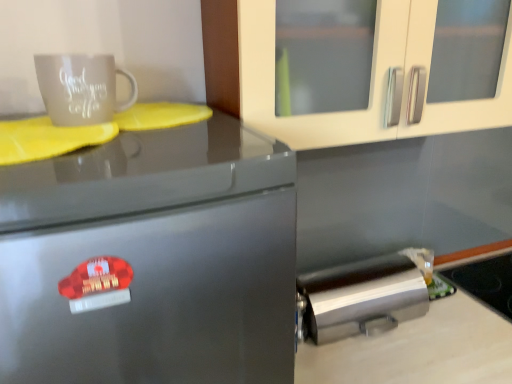
Identify the location of spots to the right of brushed metal trash can at lower right. The height and width of the screenshot is (384, 512). (464, 322).